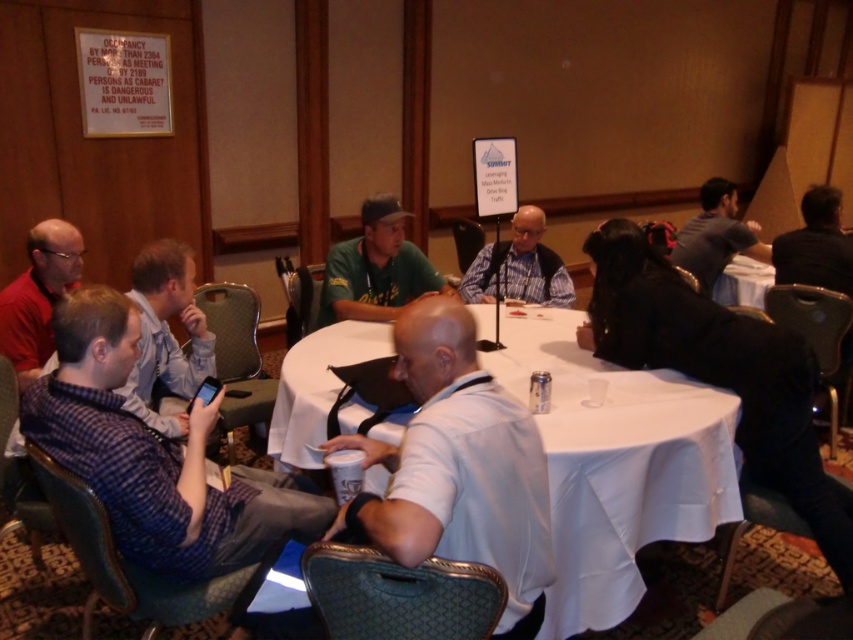
Consider the image. Is white cloth table at center bigger than black leather jacket at upper right?

Indeed, white cloth table at center has a larger size compared to black leather jacket at upper right.

Is white cloth table at center wider than black leather jacket at upper right?

Indeed, white cloth table at center has a greater width compared to black leather jacket at upper right.

I want to click on white cloth table at center, so click(x=618, y=465).

You are a GUI agent. You are given a task and a screenshot of the screen. Output one action in this format:
    pyautogui.click(x=<x>, y=<y>)
    Task: Click on the white cloth table at center
    The image size is (853, 640).
    Given the screenshot: What is the action you would take?
    pyautogui.click(x=618, y=465)

Which is above, white cloth table at center or plaid shirt at center?

Positioned higher is plaid shirt at center.

From the picture: Between white cloth table at center and plaid shirt at center, which one has more height?

white cloth table at center is taller.

Does point (695, 513) lie in front of point (502, 243)?

That is True.

At what (x,y) coordinates should I click in order to perform the action: click on white cloth table at center. Please return your answer as a coordinate pair (x, y). Image resolution: width=853 pixels, height=640 pixels. Looking at the image, I should click on (618, 465).

Is blue plaid shirt at left in front of white matte shirt at center?

No, it is not.

Does blue plaid shirt at left have a lesser height compared to white matte shirt at center?

Yes, blue plaid shirt at left is shorter than white matte shirt at center.

Measure the distance between blue plaid shirt at left and camera.

The distance of blue plaid shirt at left from camera is 1.50 meters.

You are a GUI agent. You are given a task and a screenshot of the screen. Output one action in this format:
    pyautogui.click(x=<x>, y=<y>)
    Task: Click on the blue plaid shirt at left
    Image resolution: width=853 pixels, height=640 pixels.
    Given the screenshot: What is the action you would take?
    pyautogui.click(x=154, y=456)